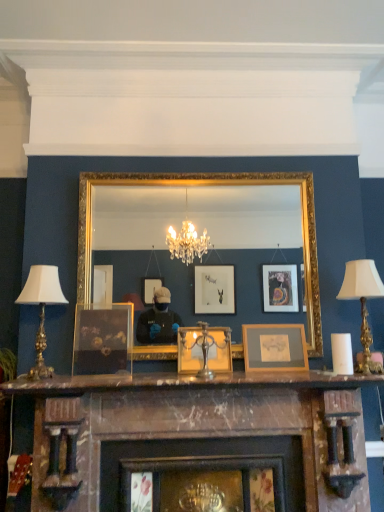
Question: Is metallic gold picture frame at center, which is counted as the 2th picture frame, starting from the right, outside marble fireplace at center?

Choices:
 (A) no
 (B) yes

Answer: (B)

Question: Can you confirm if metallic gold picture frame at center, which is counted as the 2th picture frame, starting from the right, is bigger than marble fireplace at center?

Choices:
 (A) yes
 (B) no

Answer: (B)

Question: From the image's perspective, is metallic gold picture frame at center, which is the second picture frame from left to right, on top of marble fireplace at center?

Choices:
 (A) yes
 (B) no

Answer: (A)

Question: Considering the relative sizes of metallic gold picture frame at center, which is the second picture frame from left to right, and marble fireplace at center in the image provided, is metallic gold picture frame at center, which is the second picture frame from left to right, wider than marble fireplace at center?

Choices:
 (A) no
 (B) yes

Answer: (A)

Question: Is marble fireplace at center inside metallic gold picture frame at center, which is the second picture frame from left to right?

Choices:
 (A) yes
 (B) no

Answer: (B)

Question: Is the depth of metallic gold picture frame at center, which is counted as the 2th picture frame, starting from the right, less than that of marble fireplace at center?

Choices:
 (A) no
 (B) yes

Answer: (A)

Question: Considering the relative sizes of white fabric lampshade at right, the 1th table lamp from the right, and gold-framed mirror at center in the image provided, is white fabric lampshade at right, the 1th table lamp from the right, bigger than gold-framed mirror at center?

Choices:
 (A) no
 (B) yes

Answer: (A)

Question: Are white fabric lampshade at right, the 1th table lamp from the right, and gold-framed mirror at center far apart?

Choices:
 (A) yes
 (B) no

Answer: (B)

Question: From a real-world perspective, does white fabric lampshade at right, acting as the 2th table lamp starting from the left, sit lower than gold-framed mirror at center?

Choices:
 (A) yes
 (B) no

Answer: (A)

Question: Considering the relative positions of white fabric lampshade at right, acting as the 2th table lamp starting from the left, and gold-framed mirror at center in the image provided, is white fabric lampshade at right, acting as the 2th table lamp starting from the left, to the right of gold-framed mirror at center from the viewer's perspective?

Choices:
 (A) yes
 (B) no

Answer: (A)

Question: Is white fabric lampshade at right, the 1th table lamp from the right, closer to the viewer compared to gold-framed mirror at center?

Choices:
 (A) yes
 (B) no

Answer: (A)

Question: Is white fabric lampshade at right, acting as the 2th table lamp starting from the left, smaller than gold-framed mirror at center?

Choices:
 (A) yes
 (B) no

Answer: (A)

Question: Does marble fireplace at center have a greater height compared to marble mantel at center?

Choices:
 (A) yes
 (B) no

Answer: (A)